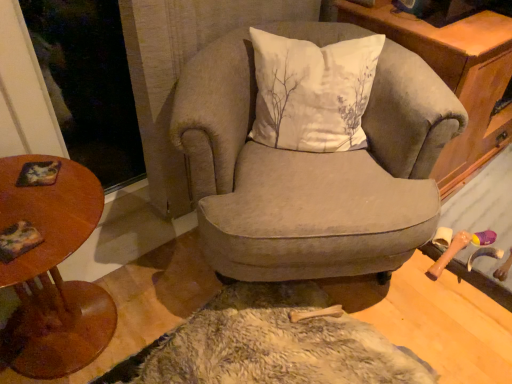
Identify the location of vacant space situated above wooden round table at left (from a real-world perspective). This screenshot has width=512, height=384. (38, 198).